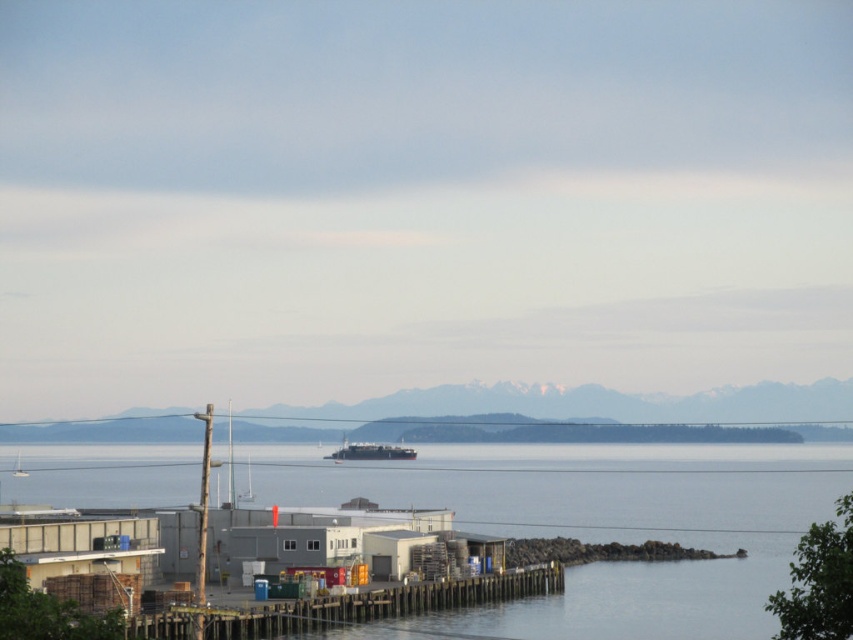
Is clear water at dock center thinner than metallic gray barge at center?

No, clear water at dock center is not thinner than metallic gray barge at center.

How far apart are clear water at dock center and metallic gray barge at center?

clear water at dock center and metallic gray barge at center are 46.23 meters apart from each other.

Which is in front, point (728, 481) or point (347, 456)?

Positioned in front is point (728, 481).

Locate an element on the screen. The width and height of the screenshot is (853, 640). clear water at dock center is located at coordinates (601, 524).

Is wooden at lower left positioned behind metallic gray barge at center?

No, it is in front of metallic gray barge at center.

Who is positioned more to the right, wooden at lower left or metallic gray barge at center?

wooden at lower left

Does point (444, 586) come farther from viewer compared to point (341, 456)?

No, (444, 586) is closer to viewer.

Locate an element on the screen. This screenshot has height=640, width=853. wooden at lower left is located at coordinates (378, 604).

Which is in front, point (317, 508) or point (222, 634)?

Point (222, 634) is in front.

Is clear water at dock center to the left of wooden at lower left from the viewer's perspective?

Incorrect, clear water at dock center is not on the left side of wooden at lower left.

Is point (724, 588) in front of point (401, 611)?

No, it is behind (401, 611).

Image resolution: width=853 pixels, height=640 pixels. I want to click on clear water at dock center, so click(601, 524).